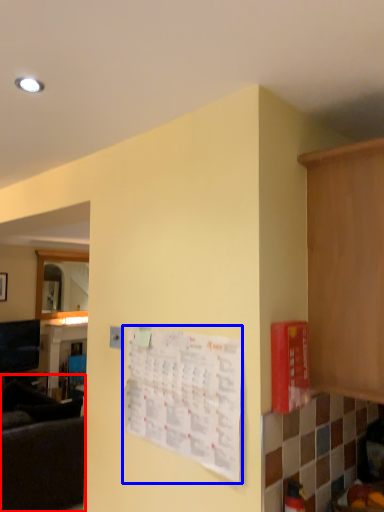
Question: Which of the following is the closest to the observer, couch (highlighted by a red box) or bulletin board (highlighted by a blue box)?

Choices:
 (A) couch
 (B) bulletin board

Answer: (B)